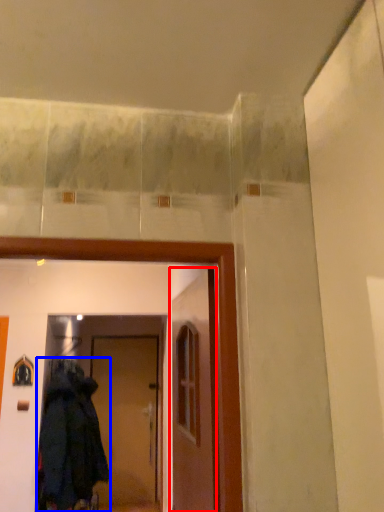
Question: Which of the following is the closest to the observer, door (highlighted by a red box) or coat (highlighted by a blue box)?

Choices:
 (A) door
 (B) coat

Answer: (A)